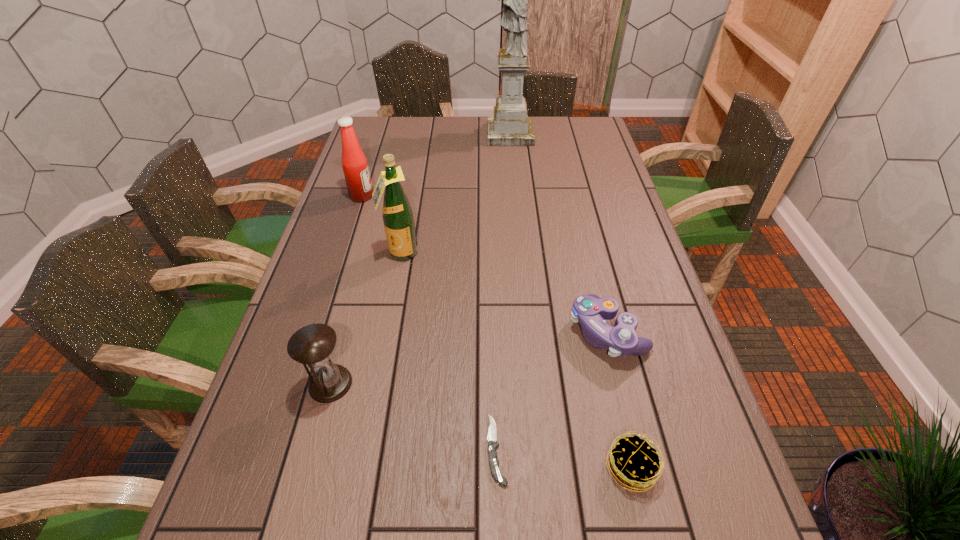
Locate an element on the screen. This screenshot has height=540, width=960. vacant point located between the tallest object and the fifth object from right to left is located at coordinates (455, 194).

Locate an element on the screen. This screenshot has width=960, height=540. free spot between the pocketknife and the control is located at coordinates (552, 390).

Where is `free area in between the control and the tallest object`? free area in between the control and the tallest object is located at coordinates (559, 233).

Locate an element on the screen. The width and height of the screenshot is (960, 540). free space between the hourglass and the pocketknife is located at coordinates (414, 416).

Locate an element on the screen. This screenshot has width=960, height=540. vacant area that lies between the liquor and the control is located at coordinates pyautogui.click(x=504, y=293).

Where is `vacant area that lies between the sculpture and the hourglass`? The image size is (960, 540). vacant area that lies between the sculpture and the hourglass is located at coordinates (420, 259).

Identify the location of empty space between the fifth nearest object and the second farthest object. The width and height of the screenshot is (960, 540). (381, 225).

Identify the location of unoccupied area between the control and the third tallest object. (485, 264).

Identify which object is the third closest to the second farthest object. Please provide its 2D coordinates. Your answer should be formatted as a tuple, i.e. [(x, y)], where the tuple contains the x and y coordinates of a point satisfying the conditions above.

[(313, 344)]

Find the location of a particular element. The height and width of the screenshot is (540, 960). the closest object relative to the control is located at coordinates (633, 461).